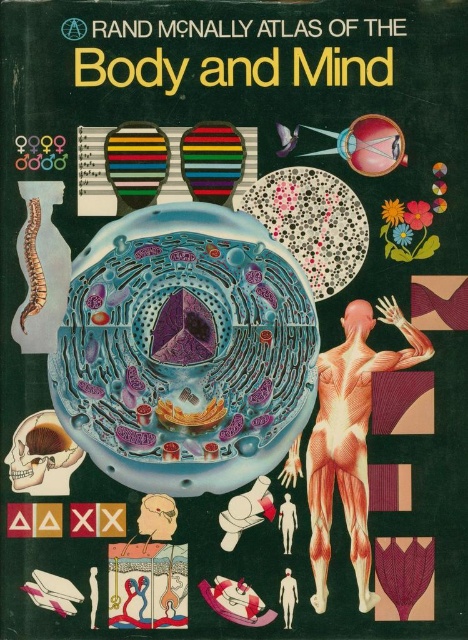
Question: Is muscular flesh at center above smooth orange human figure at center?

Choices:
 (A) no
 (B) yes

Answer: (B)

Question: Which object is closer to the camera taking this photo?

Choices:
 (A) muscular flesh at center
 (B) smooth orange human figure at center
 (C) smooth human figure at center

Answer: (A)

Question: Is smooth orange human figure at center below smooth human figure at center?

Choices:
 (A) yes
 (B) no

Answer: (B)

Question: Which point is farther to the camera?

Choices:
 (A) smooth orange human figure at center
 (B) muscular flesh at center

Answer: (A)

Question: Based on their relative distances, which object is nearer to the muscular flesh at center?

Choices:
 (A) smooth human figure at center
 (B) smooth orange human figure at center

Answer: (B)

Question: Is smooth orange human figure at center to the left of smooth human figure at center from the viewer's perspective?

Choices:
 (A) no
 (B) yes

Answer: (B)